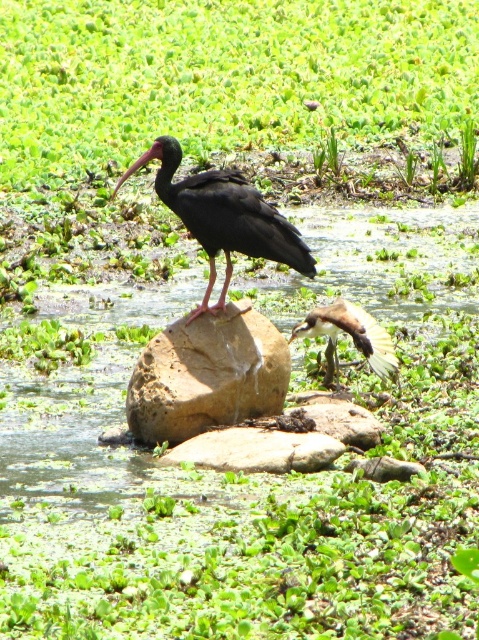
You are a photographer trying to capture the wetland scene. You notice the clear water at rock center and the brown rough rock at center. Which object is positioned closer to your camera lens?

The clear water at rock center is closer to the viewer than the brown rough rock at center, so the clear water at rock center is closer to the camera lens.

You are a small frog trying to jump from the brown rough rock at center to the clear water at rock center. Can you land safely without getting wet?

The clear water at rock center has a lesser height compared to brown rough rock at center, so the frog can safely jump from the brown rough rock at center to the clear water at rock center without getting wet.

You are a birdwatcher observing the scene. You notice both the shiny black bird at center and the brown feathered bird at center. Which bird has a greater width?

The shiny black bird at center has a greater width than the brown feathered bird at center.